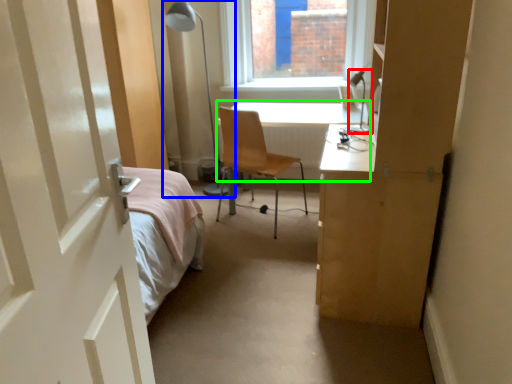
Question: Based on their relative distances, which object is farther from table lamp (highlighted by a red box)? Choose from table lamp (highlighted by a blue box) and table (highlighted by a green box).

Choices:
 (A) table lamp
 (B) table

Answer: (A)